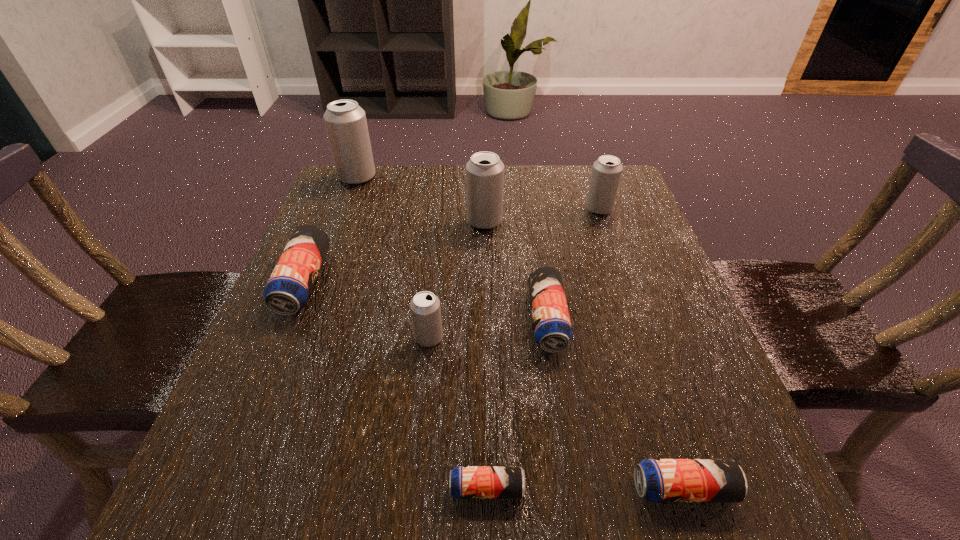
Locate an element on the screen. the third beer can from right to left is located at coordinates (552, 328).

The image size is (960, 540). Find the location of `the second blue beer can from right to left`. the second blue beer can from right to left is located at coordinates (552, 328).

Locate an element on the screen. The height and width of the screenshot is (540, 960). the second shortest object is located at coordinates (657, 480).

Locate an element on the screen. The image size is (960, 540). the rightmost blue beer can is located at coordinates (657, 480).

Image resolution: width=960 pixels, height=540 pixels. I want to click on the smallest blue beer can, so click(x=466, y=482).

I want to click on the shortest beer can, so click(466, 482).

What are the coordinates of `free space located 0.120m on the front of the biggest white beer can` in the screenshot? It's located at (344, 213).

I want to click on vacant region located 0.190m on the front of the second tallest beer can, so click(486, 289).

Where is `vacant space situated on the left of the second smallest white beer can`? vacant space situated on the left of the second smallest white beer can is located at coordinates (476, 208).

Where is `vacant space located 0.260m on the left of the second white beer can from left to right`? vacant space located 0.260m on the left of the second white beer can from left to right is located at coordinates (271, 338).